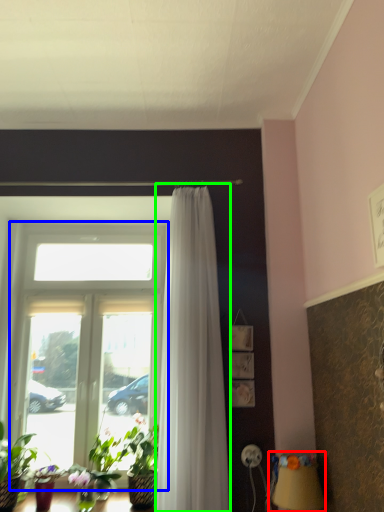
Question: Considering the real-world distances, which object is farthest from table lamp (highlighted by a red box)? window (highlighted by a blue box) or curtain (highlighted by a green box)?

Choices:
 (A) window
 (B) curtain

Answer: (A)